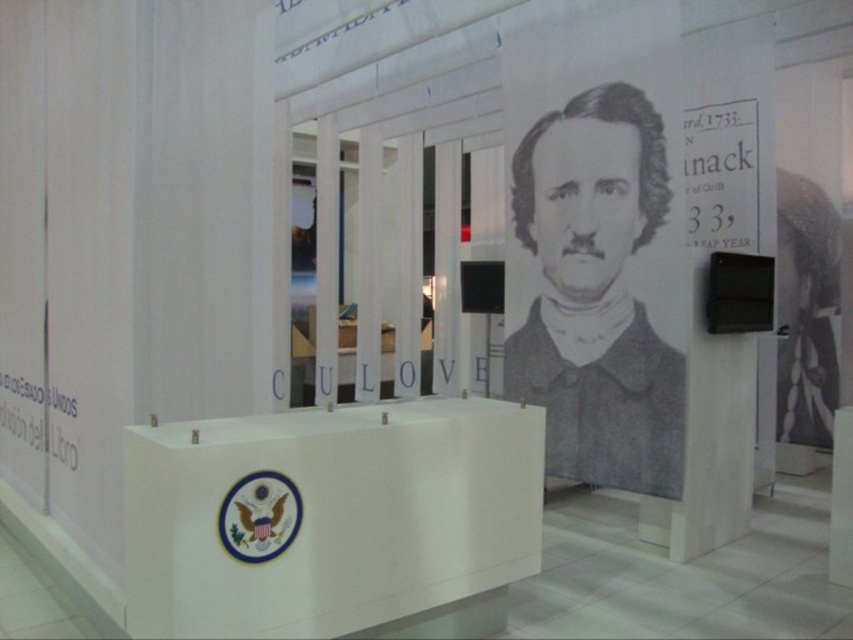
Question: Which object appears closest to the camera in this image?

Choices:
 (A) gray pencil portrait at center
 (B) white glossy podium at center

Answer: (B)

Question: Which point is farther from the camera taking this photo?

Choices:
 (A) (252, 417)
 (B) (553, 248)

Answer: (B)

Question: Is white glossy podium at center positioned in front of gray pencil portrait at center?

Choices:
 (A) yes
 (B) no

Answer: (A)

Question: In this image, where is white glossy podium at center located relative to gray pencil portrait at center?

Choices:
 (A) right
 (B) left

Answer: (B)

Question: Does white glossy podium at center appear over gray pencil portrait at center?

Choices:
 (A) yes
 (B) no

Answer: (B)